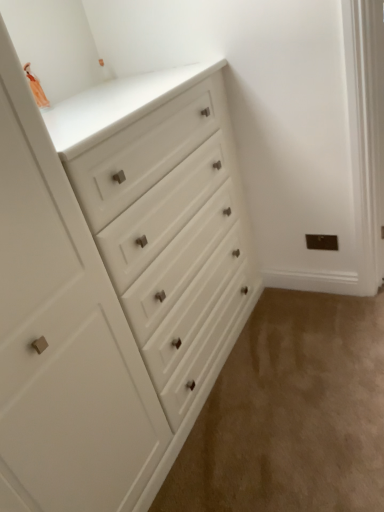
Question: From a real-world perspective, is beige carpet at lower right under white matte chest of drawers at upper left?

Choices:
 (A) no
 (B) yes

Answer: (B)

Question: Is beige carpet at lower right thinner than white matte chest of drawers at upper left?

Choices:
 (A) no
 (B) yes

Answer: (A)

Question: Considering the relative sizes of beige carpet at lower right and white matte chest of drawers at upper left in the image provided, is beige carpet at lower right wider than white matte chest of drawers at upper left?

Choices:
 (A) no
 (B) yes

Answer: (B)

Question: Does beige carpet at lower right lie behind white matte chest of drawers at upper left?

Choices:
 (A) no
 (B) yes

Answer: (B)

Question: Is beige carpet at lower right directly adjacent to white matte chest of drawers at upper left?

Choices:
 (A) yes
 (B) no

Answer: (B)

Question: Is beige carpet at lower right at the right side of white matte chest of drawers at upper left?

Choices:
 (A) no
 (B) yes

Answer: (B)

Question: Is white matte chest of drawers at upper left wider than beige carpet at lower right?

Choices:
 (A) no
 (B) yes

Answer: (A)

Question: Does white matte chest of drawers at upper left lie in front of beige carpet at lower right?

Choices:
 (A) no
 (B) yes

Answer: (B)

Question: Is white matte chest of drawers at upper left bigger than beige carpet at lower right?

Choices:
 (A) yes
 (B) no

Answer: (A)

Question: From a real-world perspective, is white matte chest of drawers at upper left located higher than beige carpet at lower right?

Choices:
 (A) yes
 (B) no

Answer: (A)

Question: Considering the relative sizes of white matte chest of drawers at upper left and beige carpet at lower right in the image provided, is white matte chest of drawers at upper left thinner than beige carpet at lower right?

Choices:
 (A) yes
 (B) no

Answer: (A)

Question: Could you tell me if white matte chest of drawers at upper left is facing beige carpet at lower right?

Choices:
 (A) yes
 (B) no

Answer: (A)

Question: Is beige carpet at lower right in front of or behind white matte chest of drawers at upper left in the image?

Choices:
 (A) front
 (B) behind

Answer: (B)